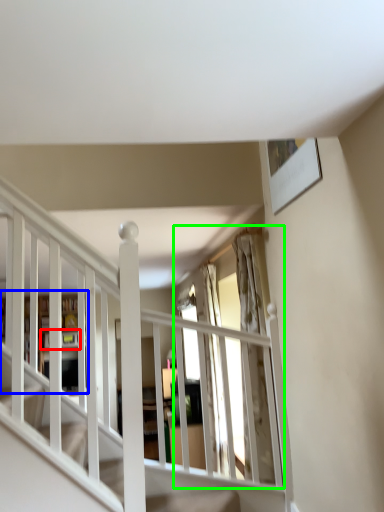
Question: Which object is the farthest from shelf (highlighted by a red box)? Choose among these: bookshelf (highlighted by a blue box) or window (highlighted by a green box).

Choices:
 (A) bookshelf
 (B) window

Answer: (B)